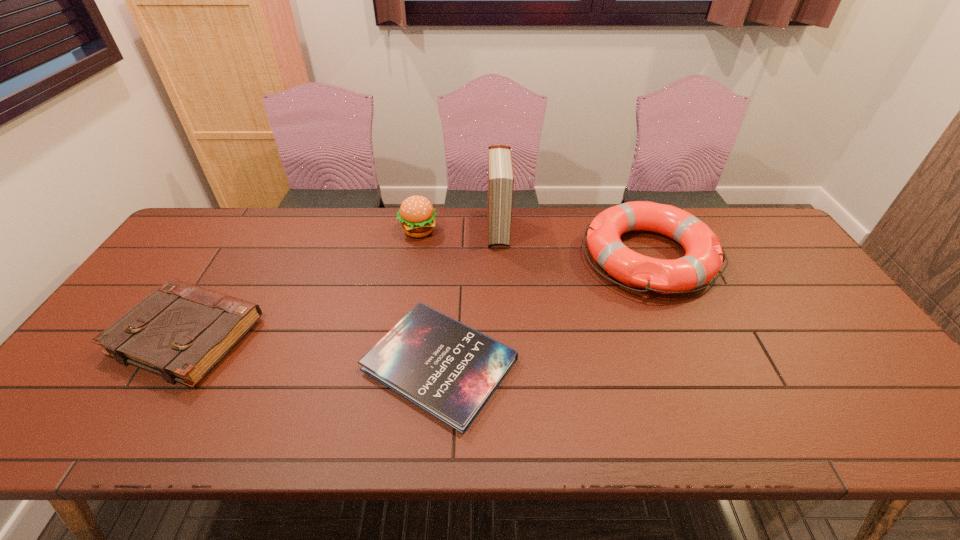
Find the location of a particular element. The image size is (960, 540). the farthest hardback book is located at coordinates (500, 168).

The width and height of the screenshot is (960, 540). Identify the location of the tallest object. (500, 168).

Identify the location of the second tallest object. (417, 215).

Find the location of a particular element. The image size is (960, 540). life buoy is located at coordinates (704, 257).

Locate an element on the screen. the rightmost object is located at coordinates (704, 257).

At what (x,y) coordinates should I click in order to perform the action: click on the leftmost hardback book. Please return your answer as a coordinate pair (x, y). Image resolution: width=960 pixels, height=540 pixels. Looking at the image, I should click on (181, 331).

The width and height of the screenshot is (960, 540). I want to click on the leftmost object, so click(x=181, y=331).

In order to click on the shortest object in this screenshot , I will do `click(450, 370)`.

Locate an element on the screen. This screenshot has width=960, height=540. vacant point located on the open cover of the farthest hardback book is located at coordinates (503, 334).

The image size is (960, 540). Identify the location of free space located on the left of the second tallest object. (327, 231).